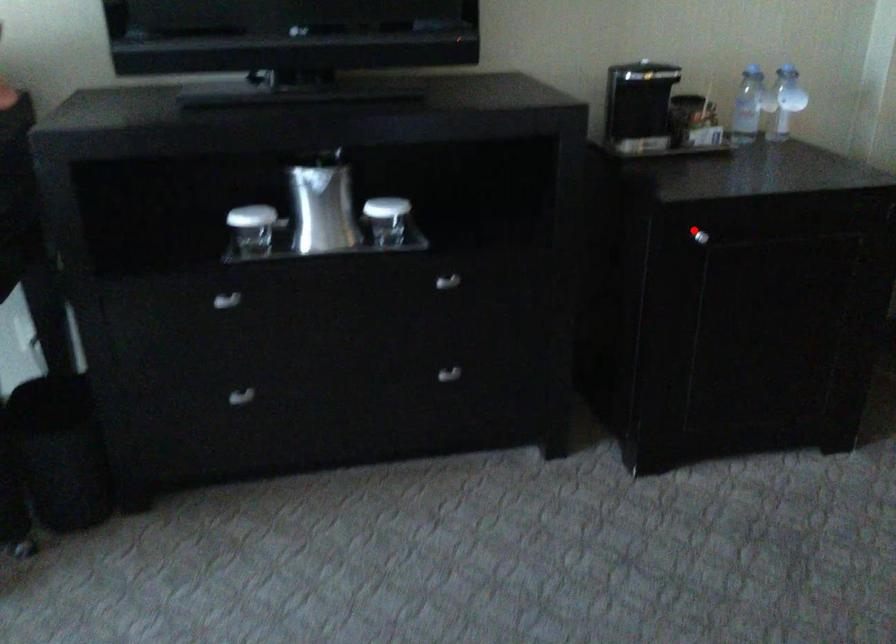
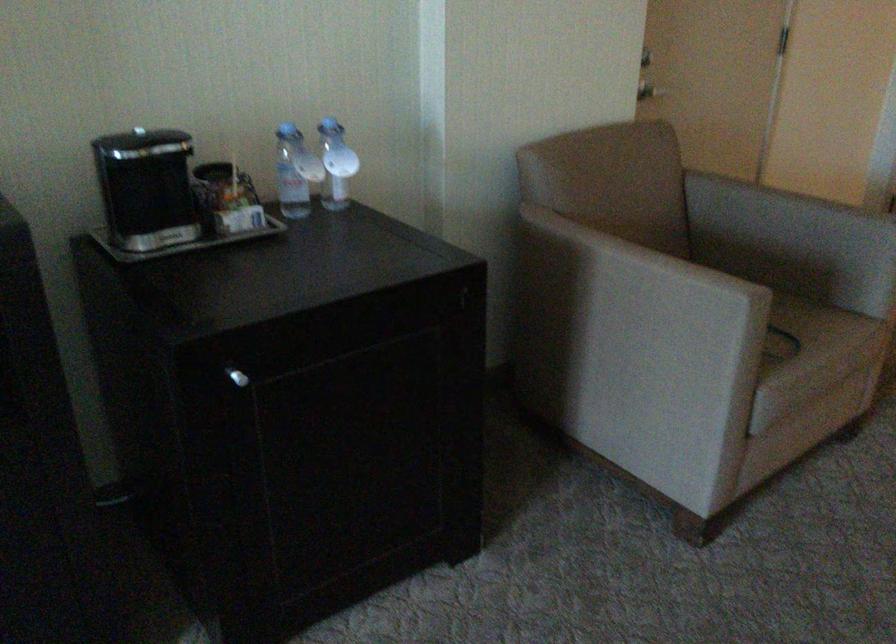
Where in the second image is the point corresponding to the highlighted location from the first image?

(237, 377)